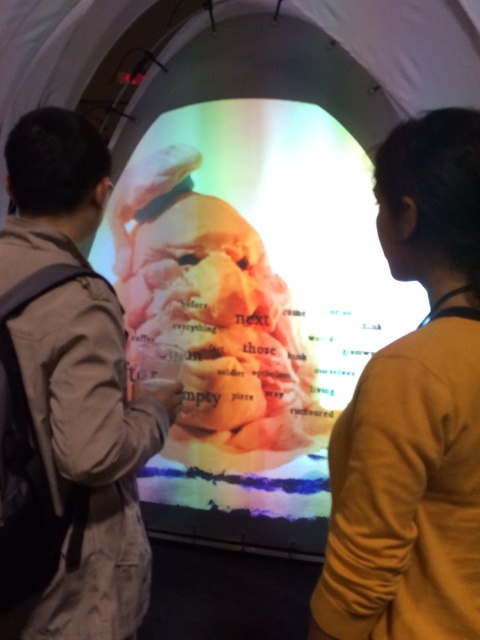
Looking at the scene described, where is the translucent plastic face at center in relation to the orange sweater at center?

The translucent plastic face at center is to the left of the orange sweater at center.

You are an artist trying to create a digital painting inspired by this scene. You want to ensure the translucent plastic face at center and orange sweater at center are proportionally accurate. Which object should you make taller in your artwork?

The translucent plastic face at center should be made taller than the orange sweater at center to maintain the correct proportions as seen in the scene.

You are an artist trying to paint the scene. You have to decide the layering order of the orange sweater at center and the khaki cotton jacket at left. Which one should you paint first?

The orange sweater at center is in front of the khaki cotton jacket at left, so you should paint the khaki cotton jacket at left first to ensure proper layering.